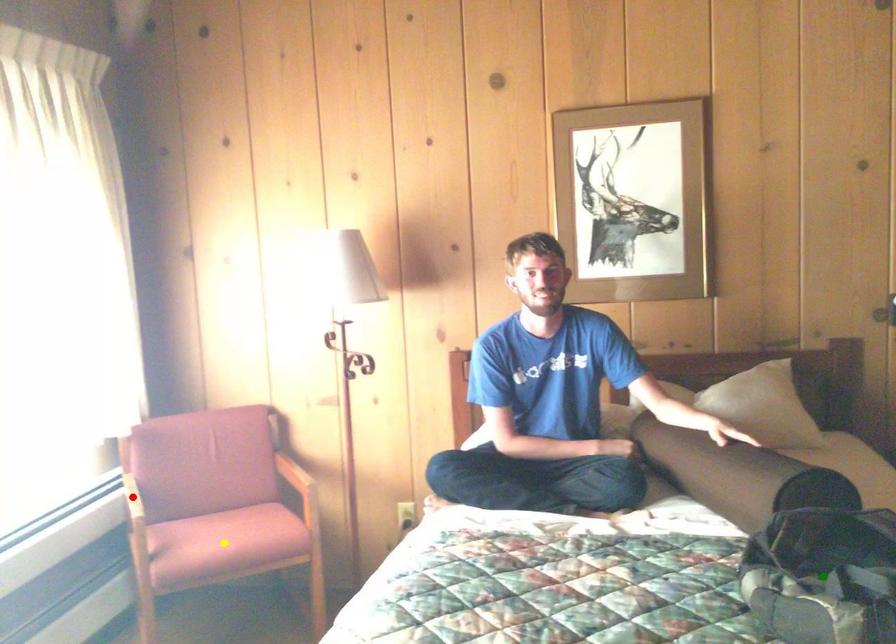
Order these from nearest to farthest:
1. green point
2. yellow point
3. red point

red point
yellow point
green point